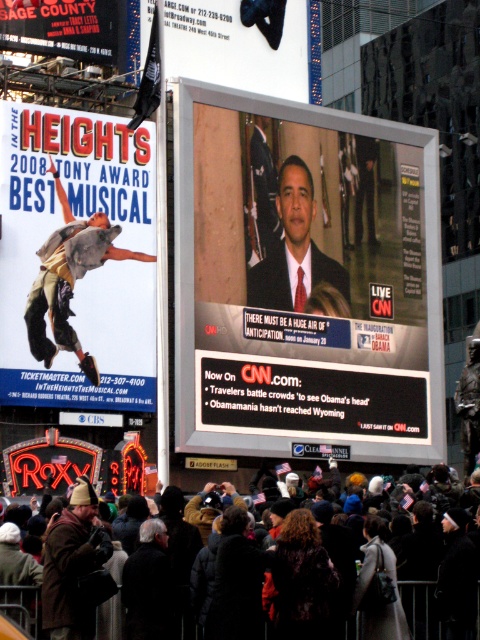
Question: Which point appears closest to the camera in this image?

Choices:
 (A) (348, 296)
 (B) (474, 616)
 (C) (256, 284)
 (D) (84, 486)

Answer: (D)

Question: Which object is the closest to the matte black poster at upper left?

Choices:
 (A) shiny silver tv at center
 (B) matte black suit at center
 (C) brown woolen hat at center
 (D) black woolen hat at center

Answer: (A)

Question: In this image, where is brown woolen hat at center located relative to black plastic billboard at upper left?

Choices:
 (A) above
 (B) below

Answer: (B)

Question: Which point is farther from the camera taking this photo?

Choices:
 (A) (54, 403)
 (B) (274, 385)

Answer: (B)

Question: Can you confirm if matte black poster at upper left is positioned to the right of black woolen hat at center?

Choices:
 (A) yes
 (B) no

Answer: (B)

Question: Can you confirm if shiny silver tv at center is smaller than black woolen hat at center?

Choices:
 (A) no
 (B) yes

Answer: (A)